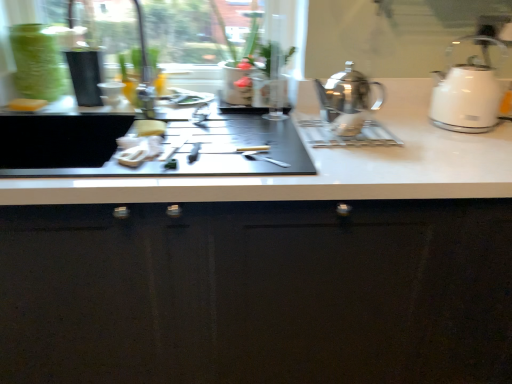
Question: Does white matte sponge at left, the 3th food when ordered from front to back, have a greater width compared to glossy black cabinet at center?

Choices:
 (A) no
 (B) yes

Answer: (A)

Question: Is white matte sponge at left, which is the 1th food in left-to-right order, facing away from glossy black cabinet at center?

Choices:
 (A) no
 (B) yes

Answer: (A)

Question: Can glossy black cabinet at center be found inside white matte sponge at left, which is the 1th food in left-to-right order?

Choices:
 (A) no
 (B) yes

Answer: (A)

Question: Can you confirm if white matte sponge at left, which is the third food from bottom to top, is smaller than glossy black cabinet at center?

Choices:
 (A) yes
 (B) no

Answer: (A)

Question: From the image's perspective, does white matte sponge at left, which ranks as the 1th food in back-to-front order, appear lower than glossy black cabinet at center?

Choices:
 (A) no
 (B) yes

Answer: (A)

Question: From the image's perspective, would you say white matte sponge at left, the 3th food when ordered from front to back, is positioned over glossy black cabinet at center?

Choices:
 (A) yes
 (B) no

Answer: (A)

Question: Does white glossy kettle at right, acting as the 1th kettle starting from the right, have a lesser height compared to shiny metallic kettle at center, the second kettle when ordered from right to left?

Choices:
 (A) yes
 (B) no

Answer: (B)

Question: Is white glossy kettle at right, which is the second kettle in left-to-right order, wider than shiny metallic kettle at center, the second kettle when ordered from right to left?

Choices:
 (A) yes
 (B) no

Answer: (A)

Question: From the image's perspective, is white glossy kettle at right, which is the second kettle in left-to-right order, below shiny metallic kettle at center, which appears as the first kettle when viewed from the left?

Choices:
 (A) no
 (B) yes

Answer: (A)

Question: Is white glossy kettle at right, acting as the 1th kettle starting from the right, bigger than shiny metallic kettle at center, which appears as the first kettle when viewed from the left?

Choices:
 (A) yes
 (B) no

Answer: (A)

Question: From a real-world perspective, is white glossy kettle at right, which is the second kettle in left-to-right order, beneath shiny metallic kettle at center, the second kettle when ordered from right to left?

Choices:
 (A) no
 (B) yes

Answer: (A)

Question: Can you confirm if white glossy kettle at right, which is the second kettle in left-to-right order, is taller than shiny metallic kettle at center, the second kettle when ordered from right to left?

Choices:
 (A) yes
 (B) no

Answer: (A)

Question: From the image's perspective, is yellow sponge at center, marked as the 2th food in a right-to-left arrangement, below shiny metallic kettle at center, which appears as the first kettle when viewed from the left?

Choices:
 (A) yes
 (B) no

Answer: (A)